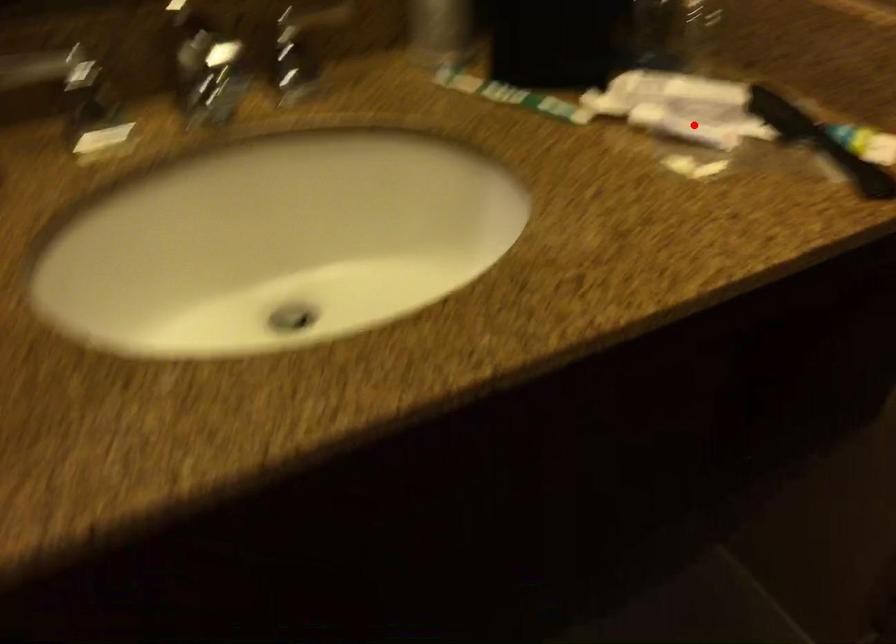
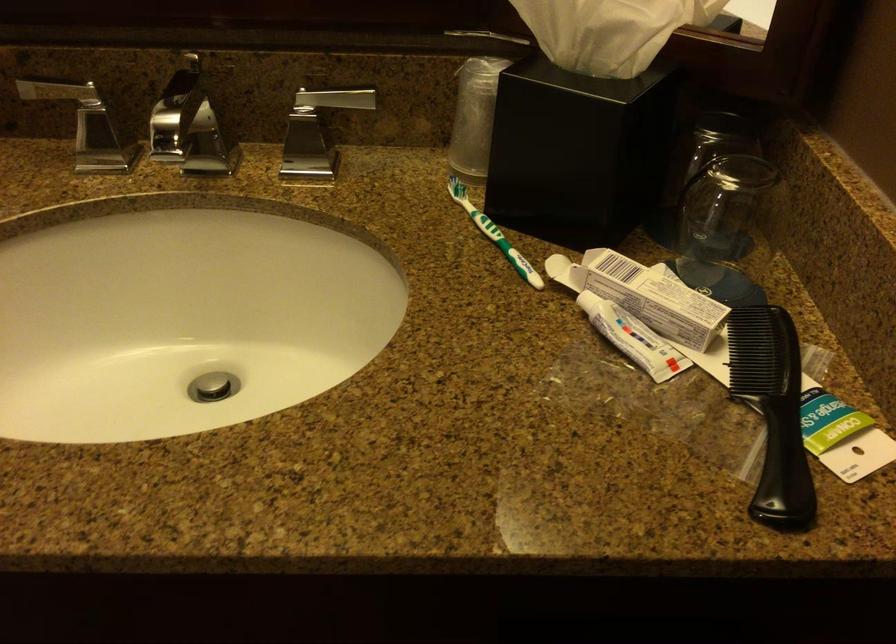
In the second image, find the point that corresponds to the highlighted location in the first image.

(633, 337)